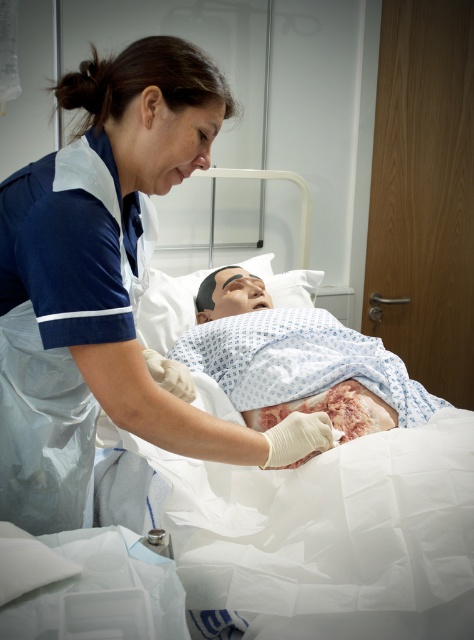
Question: From the image, what is the correct spatial relationship of blue uniform at center in relation to scarred skin at center?

Choices:
 (A) left
 (B) right

Answer: (A)

Question: Does blue uniform at center come behind scarred skin at center?

Choices:
 (A) no
 (B) yes

Answer: (A)

Question: Which of the following is the closest to the observer?

Choices:
 (A) blue uniform at center
 (B) scarred skin at center

Answer: (A)

Question: Can you confirm if blue uniform at center is positioned to the left of scarred skin at center?

Choices:
 (A) yes
 (B) no

Answer: (A)

Question: Which point is farther from the camera taking this photo?

Choices:
 (A) (74, 216)
 (B) (347, 364)

Answer: (B)